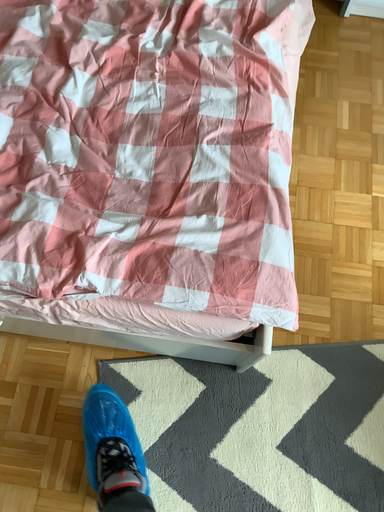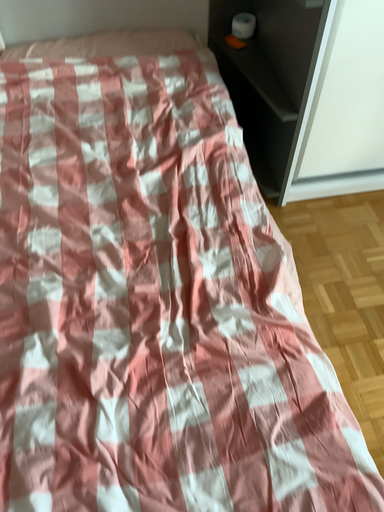
Question: How did the camera likely rotate when shooting the video?

Choices:
 (A) rotated upward
 (B) rotated downward

Answer: (A)